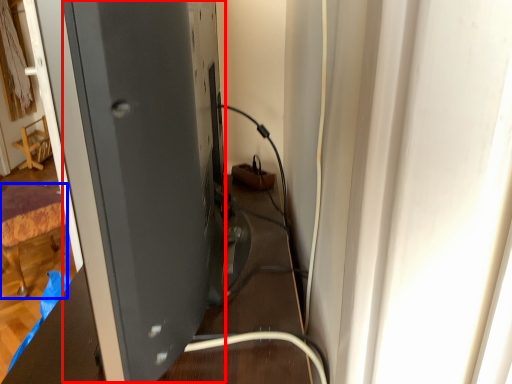
Question: Which object is further to the camera taking this photo, wide (highlighted by a red box) or furniture (highlighted by a blue box)?

Choices:
 (A) wide
 (B) furniture

Answer: (B)